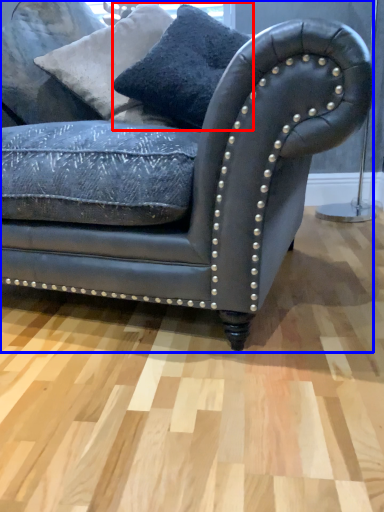
Question: Which of the following is the closest to the observer, pillow (highlighted by a red box) or studio couch (highlighted by a blue box)?

Choices:
 (A) pillow
 (B) studio couch

Answer: (B)